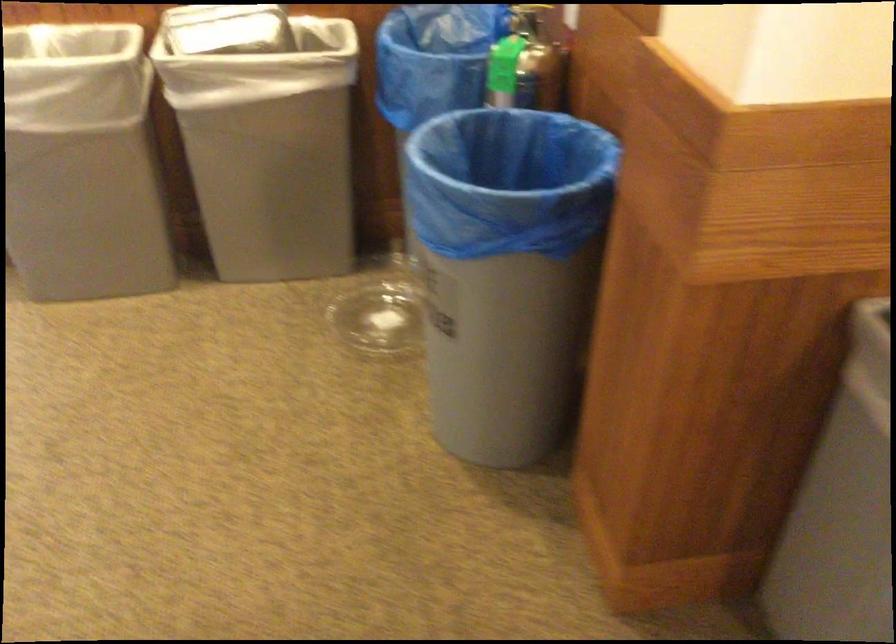
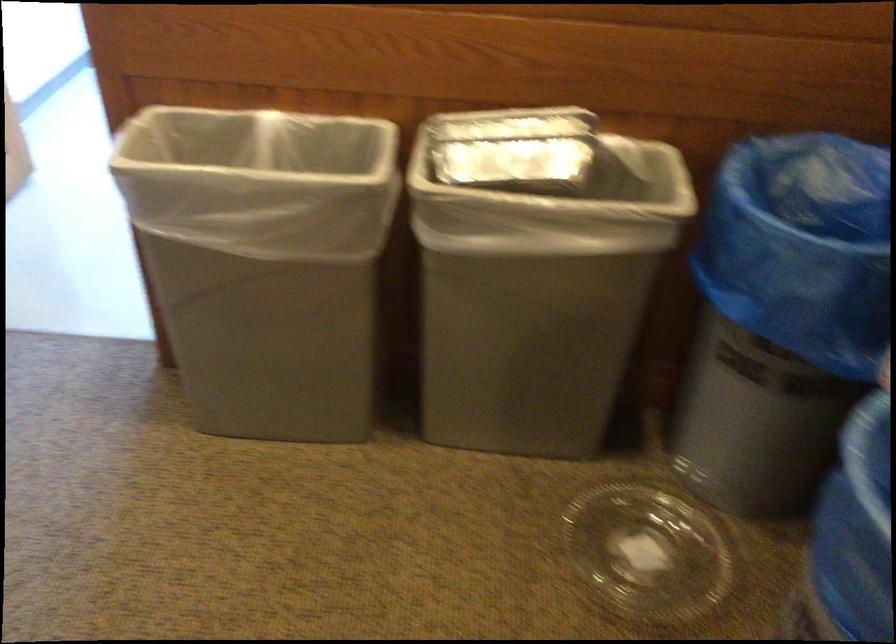
The images are taken continuously from a first-person perspective. In which direction are you moving?

The cameraman moved toward left, forward.